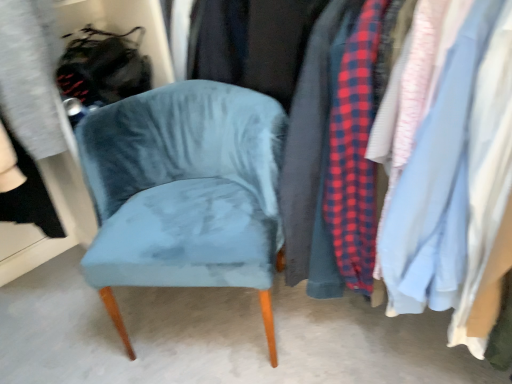
Where is `vacant region below velvet blue chair at center (from a real-world perspective)`? This screenshot has width=512, height=384. vacant region below velvet blue chair at center (from a real-world perspective) is located at coordinates (207, 320).